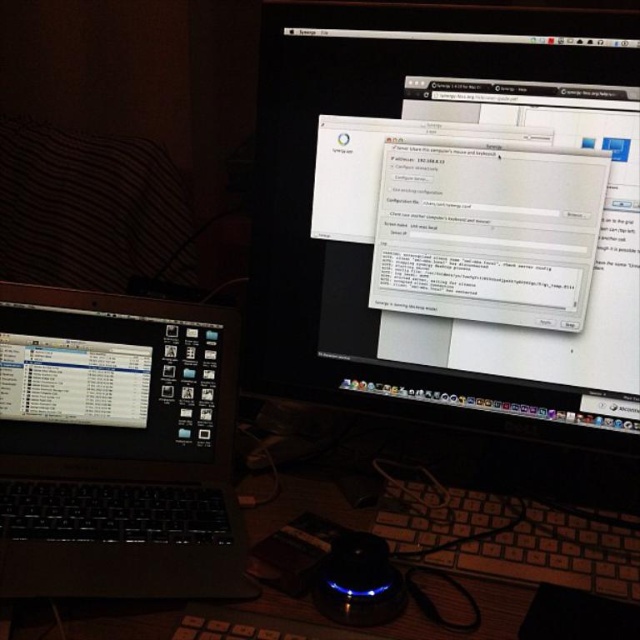
Which is more to the left, wooden at lower left or black plastic keyboard at lower center?

Positioned to the left is wooden at lower left.

Does point (72, 618) come behind point (384, 486)?

No, (72, 618) is closer to viewer.

The width and height of the screenshot is (640, 640). I want to click on wooden at lower left, so click(412, 474).

Between point (637, 317) and point (148, 426), which one is positioned behind?

Point (148, 426)

From the picture: Which is above, black glossy monitor at center or satin black laptop at left?

black glossy monitor at center

Is point (420, 301) less distant than point (152, 582)?

No, it is behind (152, 582).

Find the location of a particular element. Image resolution: width=640 pixels, height=640 pixels. black glossy monitor at center is located at coordinates (451, 216).

Does satin black laptop at left have a larger size compared to black plastic keyboard at lower center?

Correct, satin black laptop at left is larger in size than black plastic keyboard at lower center.

This screenshot has height=640, width=640. In order to click on satin black laptop at left in this screenshot , I will do `click(115, 448)`.

Measure the distance between satin black laptop at left and camera.

The distance of satin black laptop at left from camera is 22.62 inches.

I want to click on satin black laptop at left, so click(115, 448).